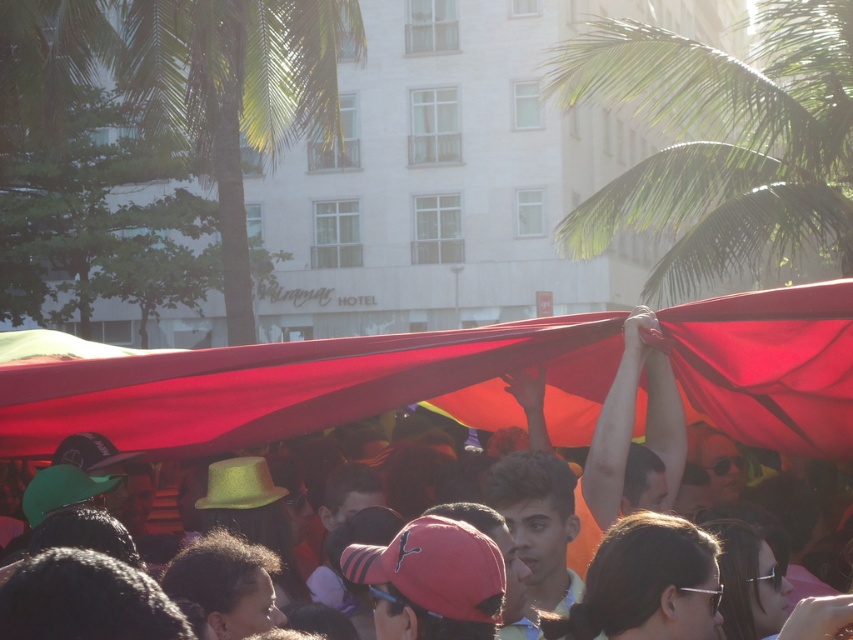
You are standing at the center of the crowd in the image and want to throw a small object to the point that is closer to you. Which point should you aim for, point (x=851, y=61) or point (x=235, y=225)?

Point (x=851, y=61) is in front of point (x=235, y=225), so you should aim for point (x=851, y=61) since it is closer to you.

You are a photographer trying to capture the entire scene in one shot. Given that the matte red fabric at center and the green leafy palm tree at upper right are both in the frame, which object would appear smaller in your photo?

The matte red fabric at center appears smaller in the photo because it has a smaller size compared to the green leafy palm tree at upper right.

You are a photographer trying to capture the entire scene of the matte red fabric at center and the green leafy palm tree at upper center in one shot. Which object should you focus on first to ensure both are in frame?

The matte red fabric at center has a smaller size compared to green leafy palm tree at upper center, so you should focus on the green leafy palm tree at upper center first to ensure both are in frame.